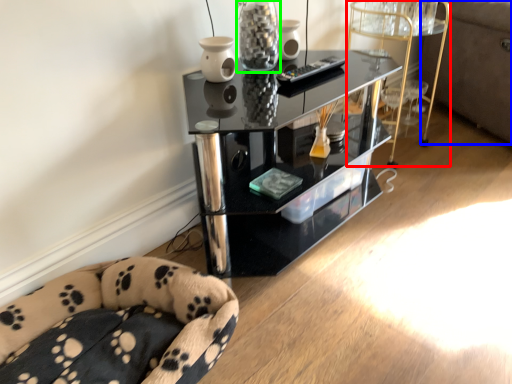
Question: Which object is positioned farthest from side table (highlighted by a red box)? Select from couch (highlighted by a blue box) and glass vase (highlighted by a green box).

Choices:
 (A) couch
 (B) glass vase

Answer: (B)